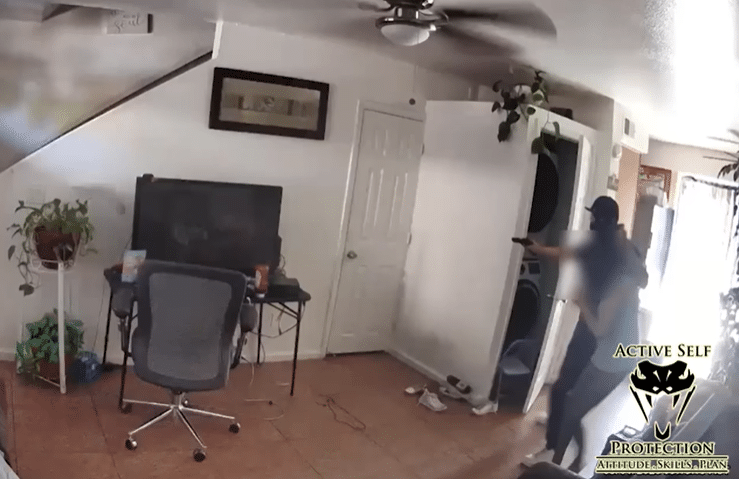
Find the location of a particular element. The height and width of the screenshot is (479, 739). chair is located at coordinates (165, 334).